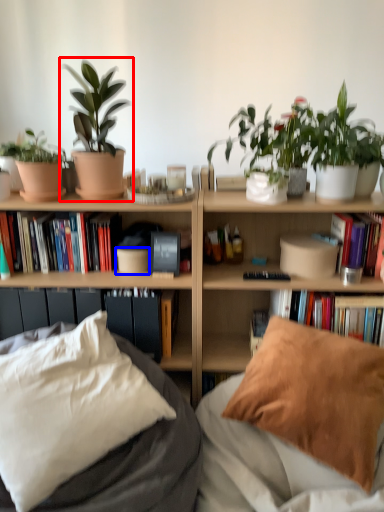
Question: Which of the following is the farthest to the observer, houseplant (highlighted by a red box) or flowerpot (highlighted by a blue box)?

Choices:
 (A) houseplant
 (B) flowerpot

Answer: (B)